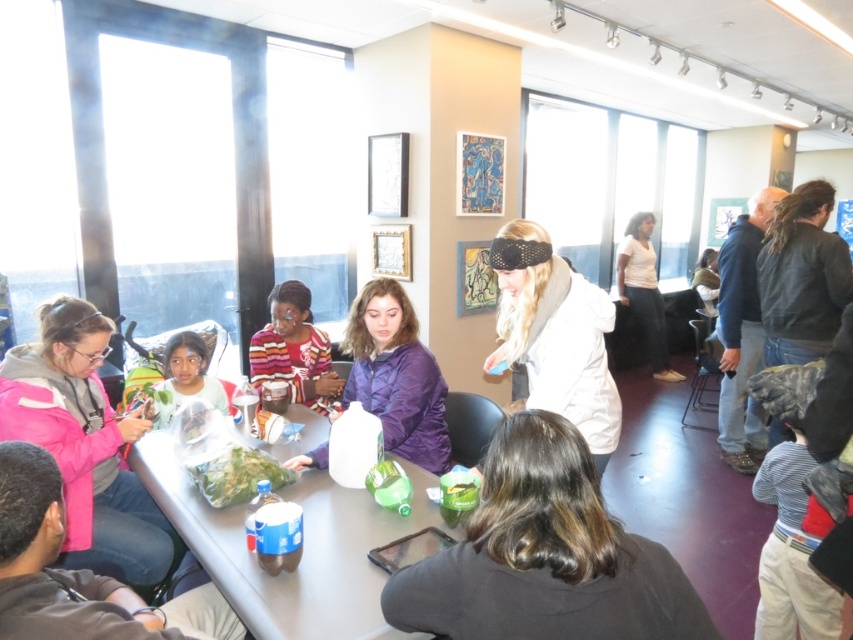
Looking at this image, does clear plastic table at center lie in front of striped sweater at center?

Yes, it is in front of striped sweater at center.

Measure the distance between point [393,531] and camera.

Point [393,531] is 1.78 meters from camera.

The width and height of the screenshot is (853, 640). Describe the element at coordinates (303, 548) in the screenshot. I see `clear plastic table at center` at that location.

Where is `clear plastic table at center`? The height and width of the screenshot is (640, 853). clear plastic table at center is located at coordinates (303, 548).

Which of these two, clear plastic table at center or white cotton shirt at upper right, stands shorter?

clear plastic table at center is shorter.

Looking at this image, is clear plastic table at center shorter than white cotton shirt at upper right?

Correct, clear plastic table at center is not as tall as white cotton shirt at upper right.

This screenshot has width=853, height=640. I want to click on clear plastic table at center, so click(x=303, y=548).

Can you confirm if white cotton shirt at upper right is positioned to the left of green plastic bag at center?

No, white cotton shirt at upper right is not to the left of green plastic bag at center.

Is white cotton shirt at upper right bigger than green plastic bag at center?

Yes.

Which is in front, point (646, 301) or point (213, 484)?

Point (213, 484) is in front.

Find the location of a particular element. This screenshot has height=640, width=853. white cotton shirt at upper right is located at coordinates (643, 291).